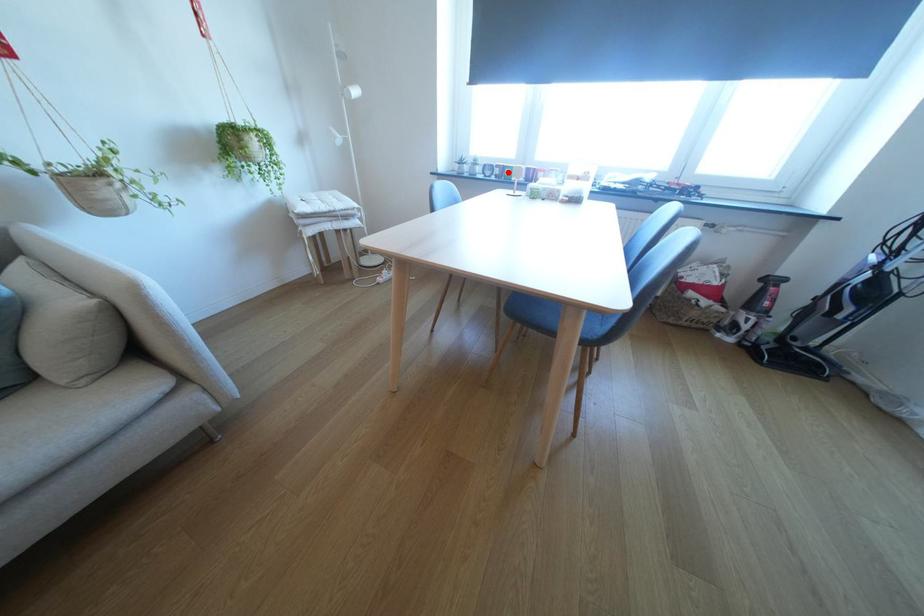
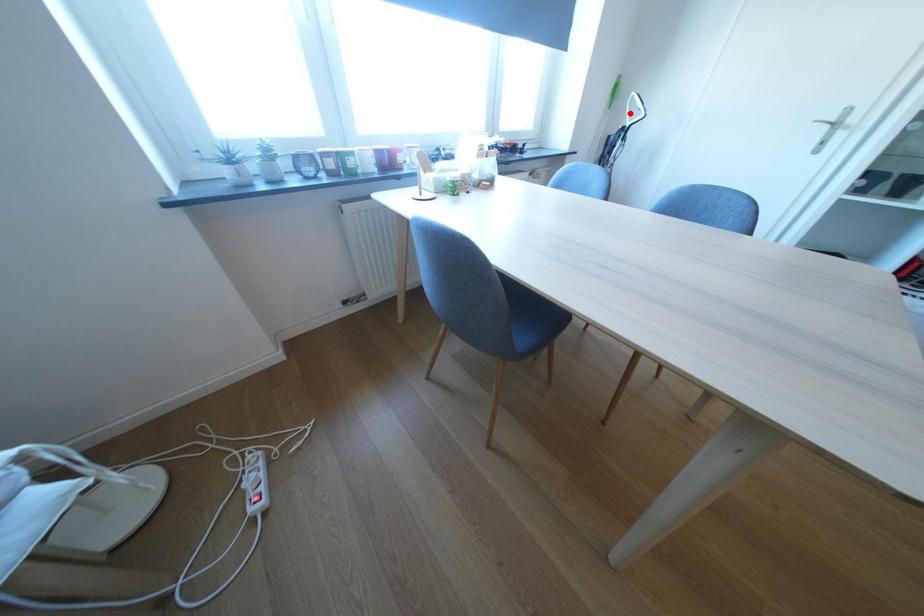
I am providing you with two images of the same scene from different viewpoints. A red point is marked on the first image and another point is marked on the second image. Are the points marked in image1 and image2 representing the same 3D position?

No